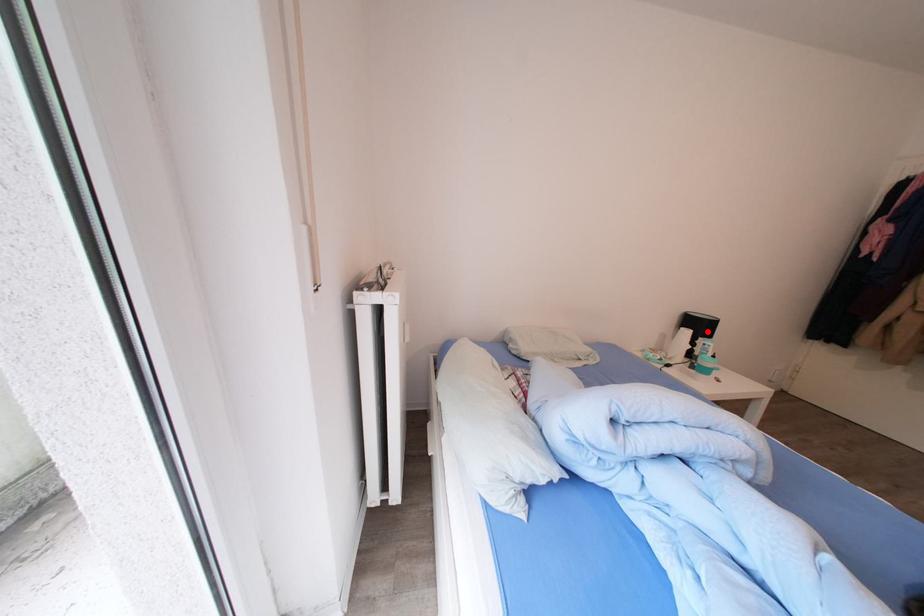
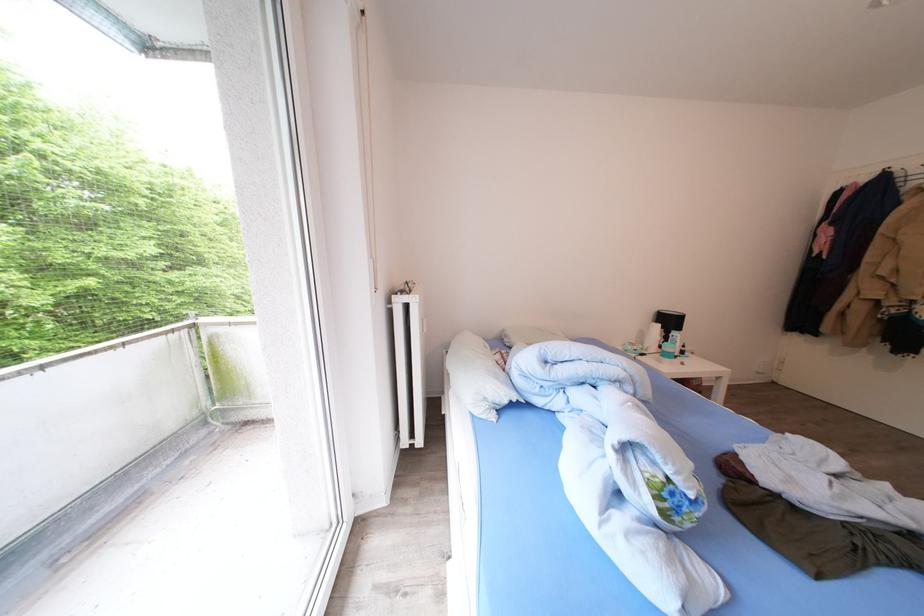
Find the pixel in the second image that matches the highlighted location in the first image.

(677, 326)